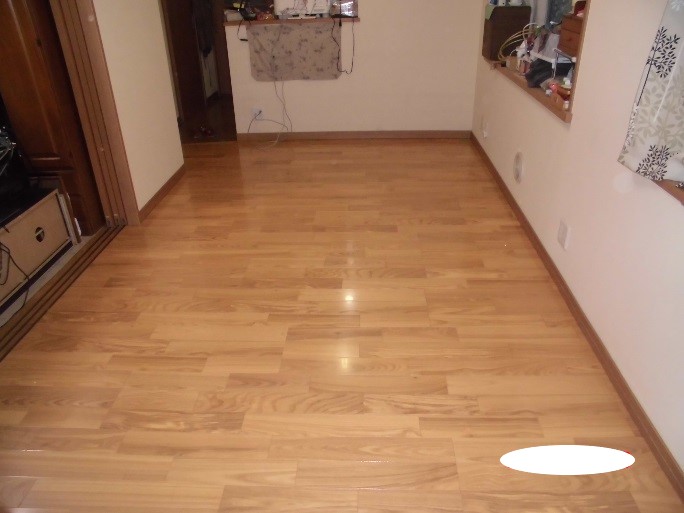
Find the location of a particular element. The height and width of the screenshot is (513, 684). door is located at coordinates (208, 103).